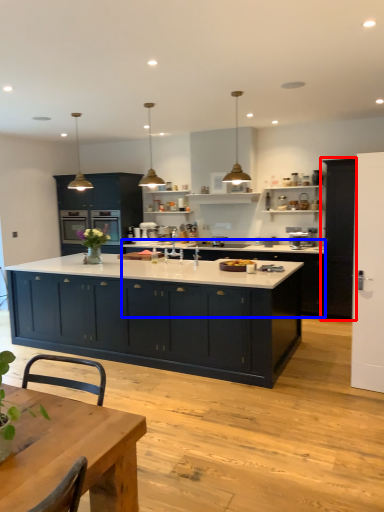
Question: Which point is further to the camera, cabinetry (highlighted by a red box) or cabinetry (highlighted by a blue box)?

Choices:
 (A) cabinetry
 (B) cabinetry

Answer: (B)